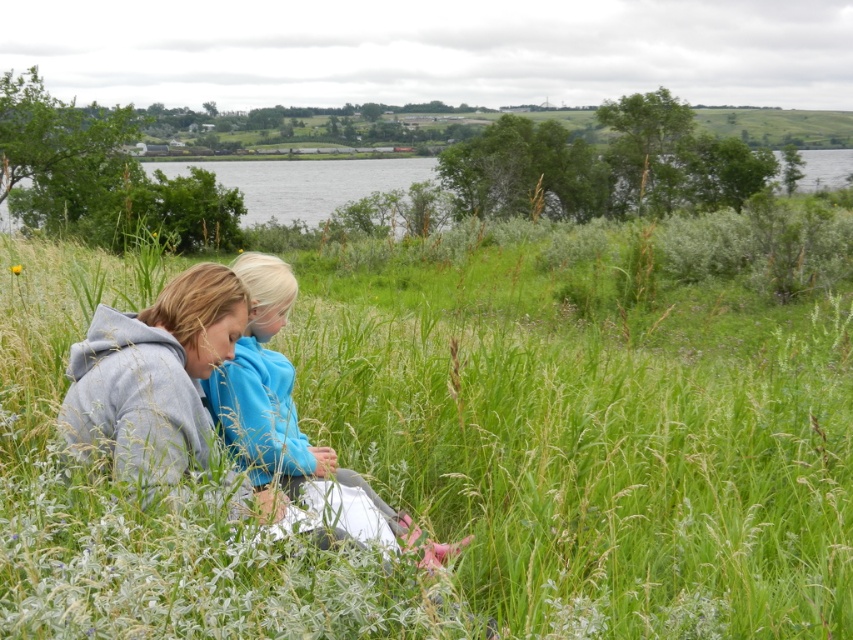
You are standing at the center of the image and want to locate the blue fleece jacket at lower left. Which direction should you look to find it?

You should look to the lower left direction to find the blue fleece jacket at lower left, as it is located at point (276, 397).

In the scene shown: You are planning to set up a small picnic blanket in the scene. Given the green grass at center and the blue fleece jacket at lower left, which object would be more suitable to place the picnic blanket on?

The green grass at center is larger in size compared to the blue fleece jacket at lower left, making it a more suitable surface for placing the picnic blanket.

Based on the scene, where is the green grass at center located in terms of coordinates?

The green grass at center is located at the coordinates point (463, 467).